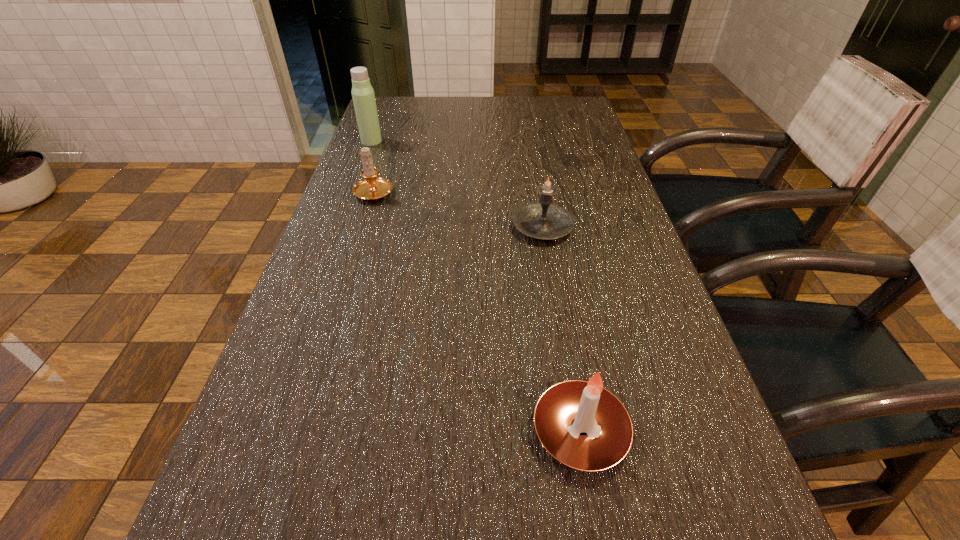
You are a GUI agent. You are given a task and a screenshot of the screen. Output one action in this format:
    pyautogui.click(x=<x>, y=<y>)
    Task: Click on the free spot that satisfies the following two spatial constraints: 1. on the front side of the second farthest object; 2. on the left side of the tallest object
    
    Given the screenshot: What is the action you would take?
    pyautogui.click(x=353, y=191)

Image resolution: width=960 pixels, height=540 pixels. Find the location of `free space that satisfies the following two spatial constraints: 1. on the front side of the second farthest candle; 2. on the left side of the nearest object`. free space that satisfies the following two spatial constraints: 1. on the front side of the second farthest candle; 2. on the left side of the nearest object is located at coordinates (577, 431).

Identify the location of vacant space that satisfies the following two spatial constraints: 1. on the front side of the third farthest object; 2. on the right side of the thermos bottle. The height and width of the screenshot is (540, 960). (340, 227).